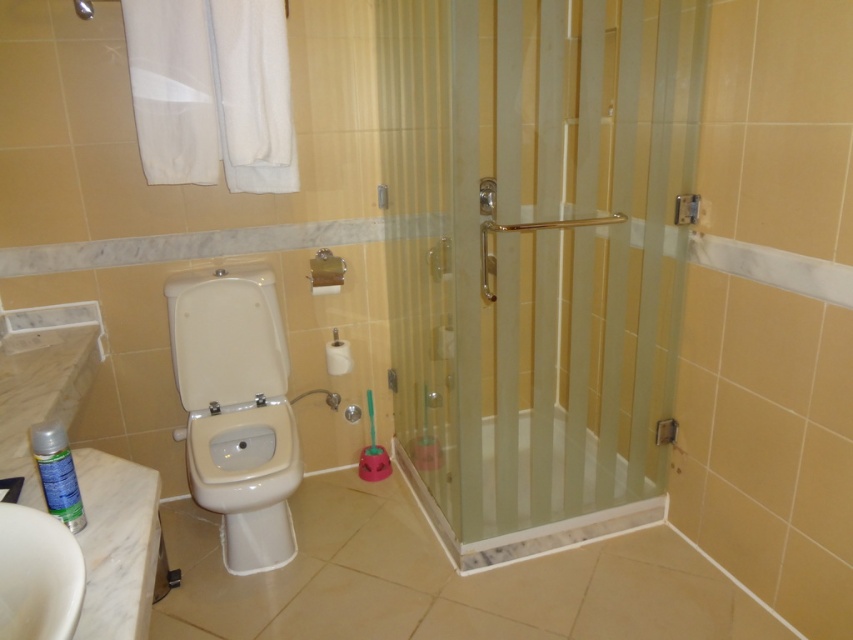
Question: Does white glossy toilet at left have a larger size compared to white glossy sink at lower left?

Choices:
 (A) yes
 (B) no

Answer: (A)

Question: Can you confirm if white glossy toilet at left is positioned to the right of white glossy sink at lower left?

Choices:
 (A) no
 (B) yes

Answer: (A)

Question: Which point is farther from the camera taking this photo?

Choices:
 (A) (520, 100)
 (B) (187, 456)
 (C) (16, 531)
 (D) (68, 520)

Answer: (B)

Question: Which point is farther from the camera taking this photo?

Choices:
 (A) (54, 492)
 (B) (537, 316)
 (C) (262, 493)
 (D) (20, 592)

Answer: (B)

Question: Estimate the real-world distances between objects in this image. Which object is farther from the white glossy sink at lower left?

Choices:
 (A) green matte spray can at lower left
 (B) clear glass shower door at right

Answer: (B)

Question: Can you confirm if white glossy toilet at left is positioned above green matte spray can at lower left?

Choices:
 (A) no
 (B) yes

Answer: (A)